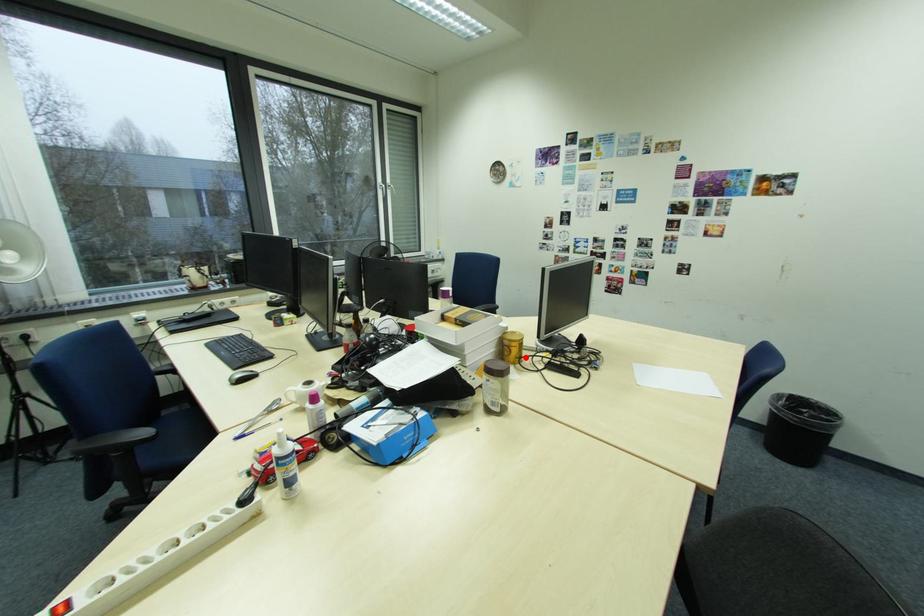
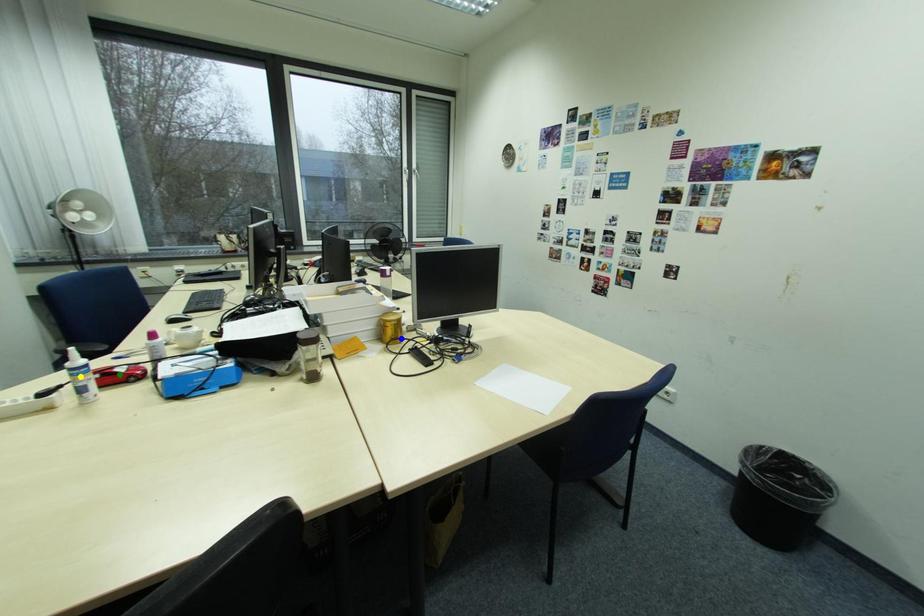
Question: I am providing you with two images of the same scene from different viewpoints. A red point is marked on the first image. You are given multiple points on the second image. Which spot in image 2 lines up with the point in image 1?

Choices:
 (A) blue point
 (B) green point
 (C) yellow point

Answer: (A)